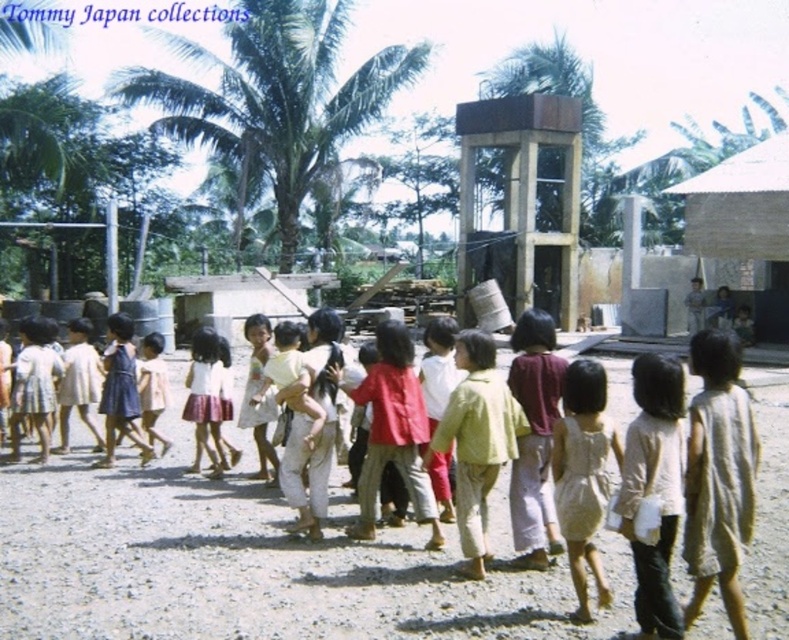
Is maroon fabric shirt at center thinner than light beige cotton dress at center?

Yes.

Is maroon fabric shirt at center positioned at the back of light beige cotton dress at center?

No, it is in front of light beige cotton dress at center.

Does point (543, 317) lie behind point (159, 410)?

No, it is in front of (159, 410).

Locate an element on the screen. maroon fabric shirt at center is located at coordinates (533, 436).

Does white stone hut at upper right have a smaller size compared to maroon fabric shirt at center?

No, white stone hut at upper right is not smaller than maroon fabric shirt at center.

Is point (730, 163) less distant than point (537, 477)?

No, it is behind (537, 477).

This screenshot has height=640, width=789. In order to click on white stone hut at upper right in this screenshot , I will do `click(746, 225)`.

Is white cotton dress at lower right further to camera compared to maroon fabric shirt at center?

No, it is not.

Is white cotton dress at lower right above maroon fabric shirt at center?

No.

Is point (685, 515) closer to camera compared to point (537, 545)?

That is True.

Identify the location of white cotton dress at lower right. (718, 476).